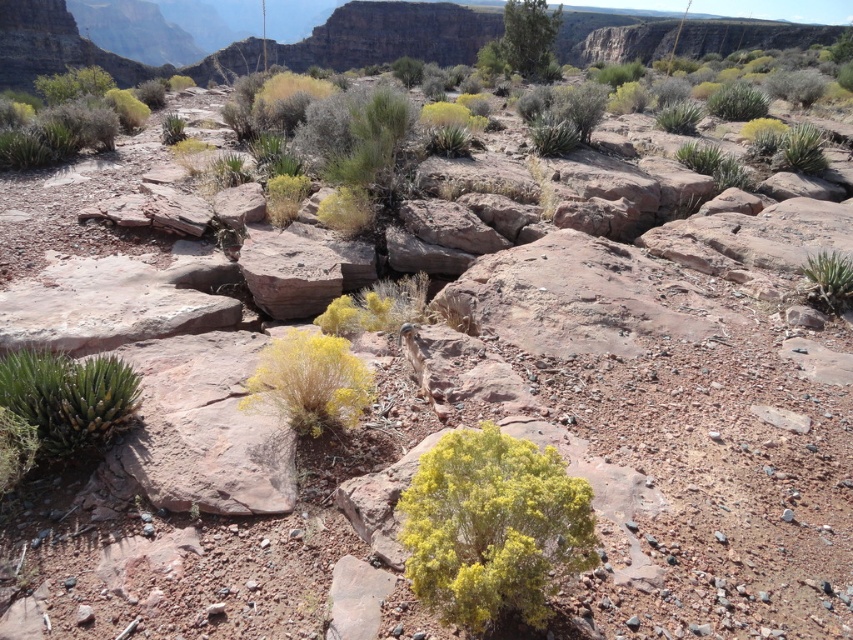
Which is below, yellow fluffy bush at center or green fuzzy plant at right?

yellow fluffy bush at center is below.

Can you confirm if yellow fluffy bush at center is positioned to the right of green fuzzy plant at right?

In fact, yellow fluffy bush at center is to the left of green fuzzy plant at right.

Is point (506, 538) farther from viewer compared to point (810, 273)?

No, it is in front of (810, 273).

The height and width of the screenshot is (640, 853). Identify the location of yellow fluffy bush at center. (492, 528).

Does yellow fluffy bush at center appear over green succulent at lower left?

Actually, yellow fluffy bush at center is below green succulent at lower left.

Locate an element on the screen. yellow fluffy bush at center is located at coordinates (492, 528).

Is point (527, 556) positioned behind point (102, 419)?

No, it is in front of (102, 419).

Locate an element on the screen. yellow fluffy bush at center is located at coordinates (492, 528).

Between green leafy tree at upper right and green fuzzy plant at right, which one is positioned lower?

Positioned lower is green fuzzy plant at right.

At what (x,y) coordinates should I click in order to perform the action: click on green leafy tree at upper right. Please return your answer as a coordinate pair (x, y). The image size is (853, 640). Looking at the image, I should click on (529, 36).